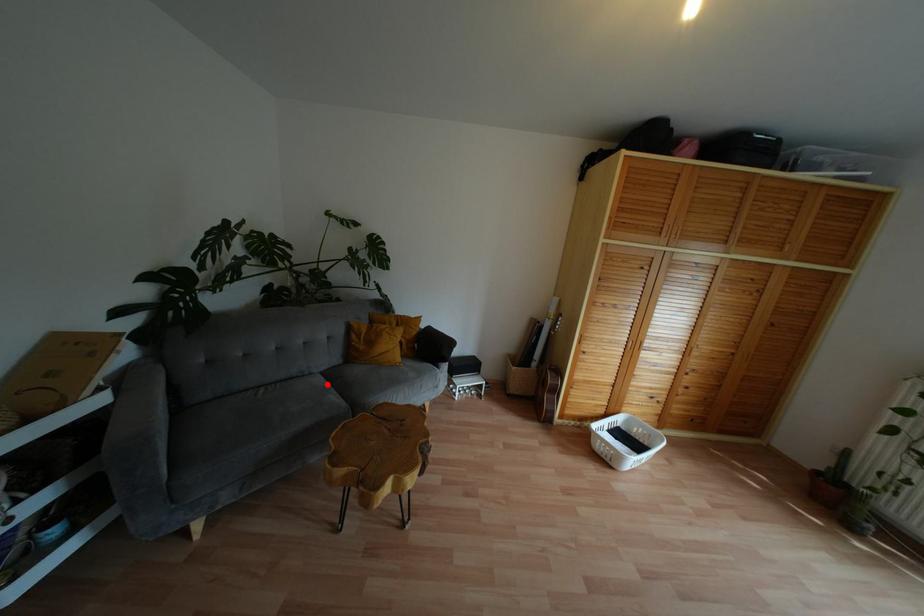
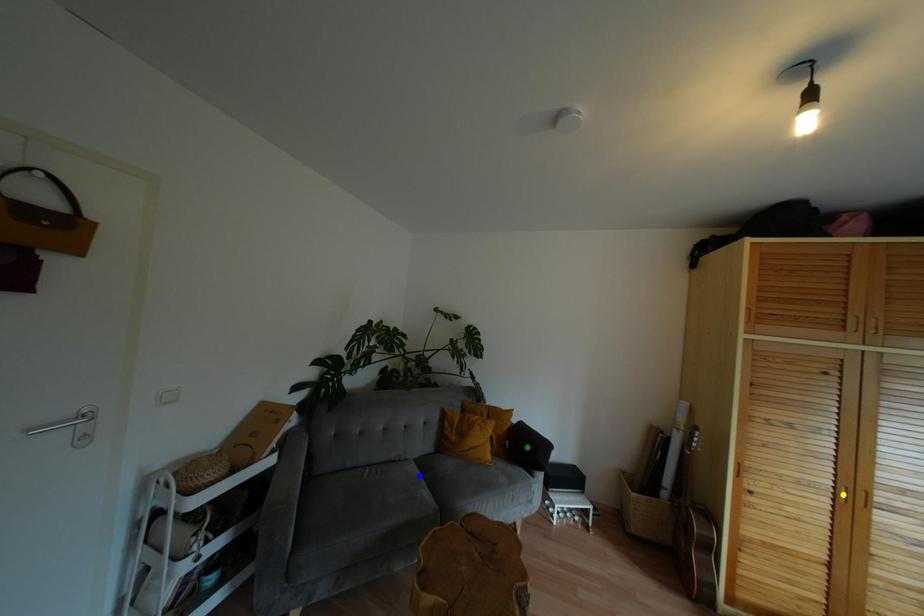
Question: I am providing you with two images of the same scene from different viewpoints. A red point is marked on the first image. You are given multiple points on the second image. Which point in image 2 represents the same 3d spot as the red point in image 1?

Choices:
 (A) blue point
 (B) yellow point
 (C) green point

Answer: (A)